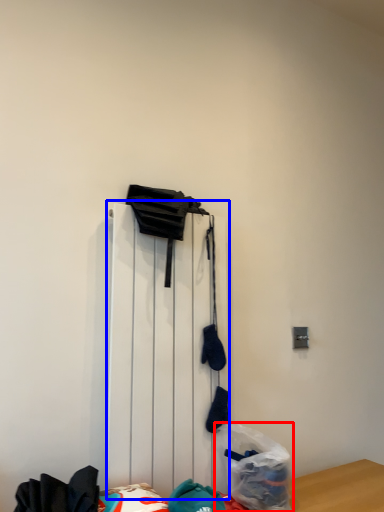
Question: Among these objects, which one is farthest to the camera, plastic bag (highlighted by a red box) or radiator (highlighted by a blue box)?

Choices:
 (A) plastic bag
 (B) radiator

Answer: (A)